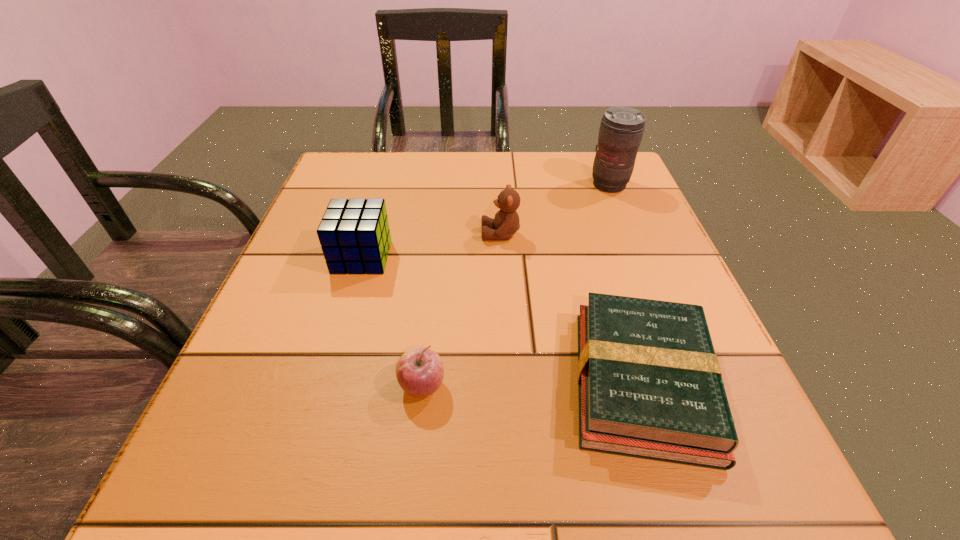
Where is `vacant space that is in between the teddy bear and the cube`? vacant space that is in between the teddy bear and the cube is located at coordinates (431, 246).

Where is `vacant space that's between the apple and the leftmost object`? This screenshot has height=540, width=960. vacant space that's between the apple and the leftmost object is located at coordinates (392, 322).

Identify the location of vacant space that's between the fourth object from right to left and the third object from right to left. This screenshot has height=540, width=960. (462, 310).

Identify the location of vacant space that is in between the farthest object and the second object from left to right. (516, 286).

You are a GUI agent. You are given a task and a screenshot of the screen. Output one action in this format:
    pyautogui.click(x=<x>, y=<y>)
    Task: Click on the free spot between the telephoto lens and the teddy bear
    The width and height of the screenshot is (960, 540).
    Given the screenshot: What is the action you would take?
    pyautogui.click(x=555, y=210)

Locate an element on the screen. The width and height of the screenshot is (960, 540). free spot between the leftmost object and the shortest object is located at coordinates (502, 320).

At what (x,y) coordinates should I click in order to perform the action: click on free area in between the teddy bear and the cube. Please return your answer as a coordinate pair (x, y). Looking at the image, I should click on (431, 246).

Where is `free area in between the telephoto lens and the third object from right to left`? The height and width of the screenshot is (540, 960). free area in between the telephoto lens and the third object from right to left is located at coordinates (555, 210).

Select which object appears as the fourth closest to the farthest object. Please provide its 2D coordinates. Your answer should be formatted as a tuple, i.e. [(x, y)], where the tuple contains the x and y coordinates of a point satisfying the conditions above.

[(419, 371)]

Identify which object is located as the fourth nearest to the leftmost object. Please provide its 2D coordinates. Your answer should be formatted as a tuple, i.e. [(x, y)], where the tuple contains the x and y coordinates of a point satisfying the conditions above.

[(621, 130)]